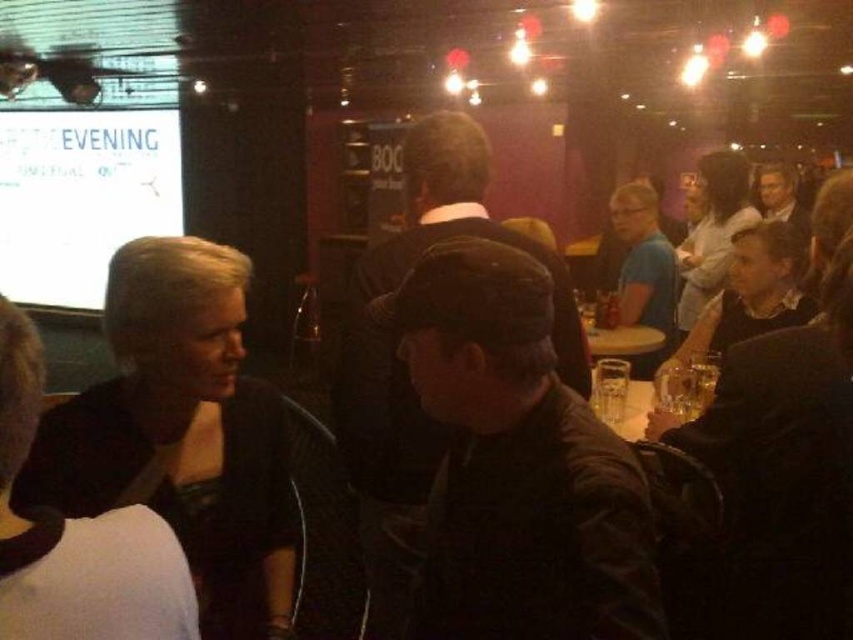
Question: Is dark brown leather jacket at lower left to the right of white glossy projection screen at upper left from the viewer's perspective?

Choices:
 (A) yes
 (B) no

Answer: (A)

Question: Which point is farther to the camera?

Choices:
 (A) (21, 227)
 (B) (206, 532)

Answer: (A)

Question: Where is dark brown leather jacket at lower left located in relation to white glossy projection screen at upper left in the image?

Choices:
 (A) below
 (B) above

Answer: (A)

Question: Is dark brown leather jacket at lower left bigger than white glossy projection screen at upper left?

Choices:
 (A) yes
 (B) no

Answer: (B)

Question: Which object is closer to the camera taking this photo?

Choices:
 (A) dark brown leather jacket at lower left
 (B) white glossy projection screen at upper left

Answer: (A)